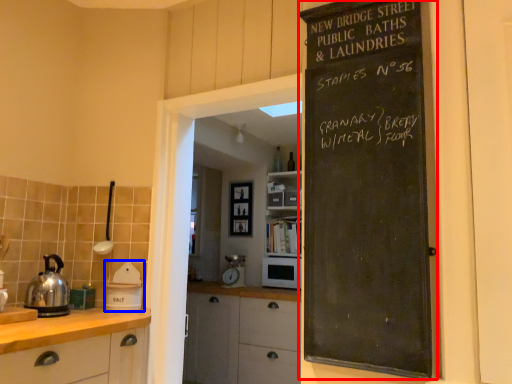
Question: Which of the following is the closest to the observer, bulletin board (highlighted by a red box) or appliance (highlighted by a blue box)?

Choices:
 (A) bulletin board
 (B) appliance

Answer: (A)